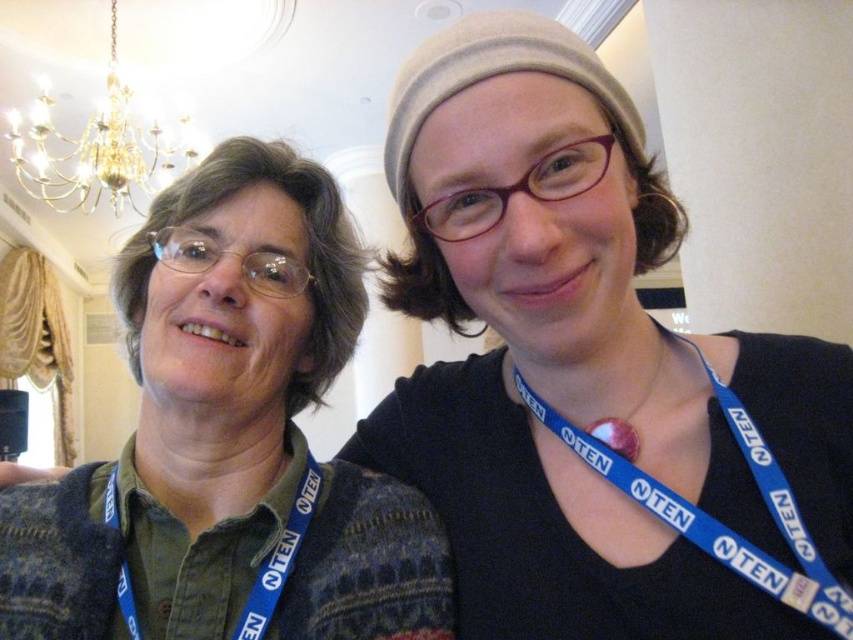
Between point (126, 164) and point (633, 323), which one is positioned in front?

Point (633, 323)

Between gold metallic chandelier at upper left and matte blue lanyard at center, which one appears on the right side from the viewer's perspective?

Positioned to the right is matte blue lanyard at center.

Who is more distant from viewer, (61, 132) or (642, 394)?

The point (61, 132) is more distant.

The height and width of the screenshot is (640, 853). In order to click on gold metallic chandelier at upper left in this screenshot , I will do `click(99, 147)`.

Who is more distant from viewer, (761, 589) or (48, 161)?

Positioned behind is point (48, 161).

Which of these two, blue fabric lanyard at upper right or gold metallic chandelier at upper left, stands shorter?

blue fabric lanyard at upper right is shorter.

Describe the element at coordinates (717, 515) in the screenshot. I see `blue fabric lanyard at upper right` at that location.

I want to click on blue fabric lanyard at upper right, so click(717, 515).

Which of these two, skinsmoothneck at center or matte blue lanyard at center, stands taller?

skinsmoothneck at center

Can you confirm if skinsmoothneck at center is taller than matte blue lanyard at center?

Yes, skinsmoothneck at center is taller than matte blue lanyard at center.

From the picture: Who is more forward, (161, 449) or (489, 336)?

Positioned in front is point (161, 449).

Where is `skinsmoothneck at center`? skinsmoothneck at center is located at coordinates tap(210, 438).